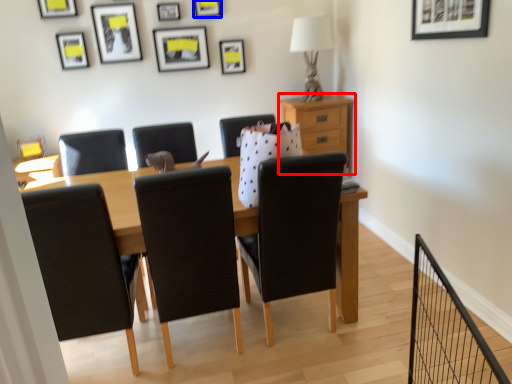
Question: Which object appears farthest to the camera in this image, nightstand (highlighted by a red box) or picture frame (highlighted by a blue box)?

Choices:
 (A) nightstand
 (B) picture frame

Answer: (A)